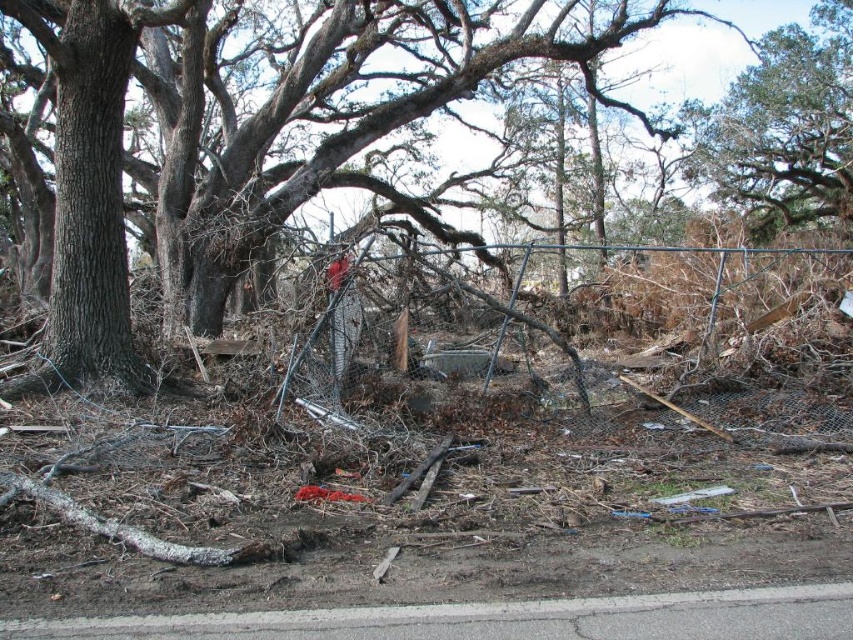
Does brown textured tree at center appear under gray asphalt curb at lower center?

Incorrect, brown textured tree at center is not positioned below gray asphalt curb at lower center.

Is brown textured tree at center bigger than gray asphalt curb at lower center?

Indeed, brown textured tree at center has a larger size compared to gray asphalt curb at lower center.

Does point (62, 336) lie behind point (523, 605)?

Yes, point (62, 336) is farther from viewer.

At what (x,y) coordinates should I click in order to perform the action: click on brown textured tree at center. Please return your answer as a coordinate pair (x, y). Looking at the image, I should click on (262, 136).

Where is `brown textured tree at center`? The width and height of the screenshot is (853, 640). brown textured tree at center is located at coordinates (262, 136).

Between brown textured tree at center and green leafy tree at upper right, which one appears on the right side from the viewer's perspective?

From the viewer's perspective, green leafy tree at upper right appears more on the right side.

Is point (202, 13) positioned behind point (821, 224)?

No, (202, 13) is in front of (821, 224).

Where is `brown textured tree at center`? This screenshot has height=640, width=853. brown textured tree at center is located at coordinates (262, 136).

Who is taller, gray asphalt curb at lower center or green leafy tree at upper right?

green leafy tree at upper right

This screenshot has height=640, width=853. I want to click on gray asphalt curb at lower center, so click(502, 620).